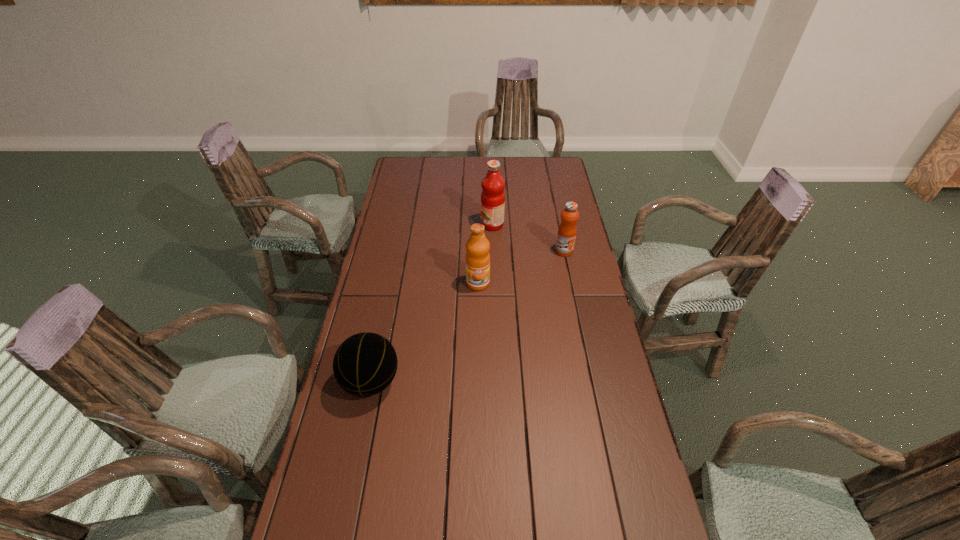
Image resolution: width=960 pixels, height=540 pixels. Find the location of `free space located 0.150m on the front label of the shortest fruit juice`. free space located 0.150m on the front label of the shortest fruit juice is located at coordinates (571, 284).

Image resolution: width=960 pixels, height=540 pixels. What are the coordinates of `vacant position located on the right of the leftmost object` in the screenshot? It's located at (509, 382).

You are a GUI agent. You are given a task and a screenshot of the screen. Output one action in this format:
    pyautogui.click(x=<x>, y=<y>)
    Task: Click on the object located at the left edge
    The width and height of the screenshot is (960, 540).
    Given the screenshot: What is the action you would take?
    pyautogui.click(x=365, y=364)

Identify the location of object that is at the right edge. (567, 230).

The width and height of the screenshot is (960, 540). In the image, there is a desktop. Find the location of `free region at the far edge`. free region at the far edge is located at coordinates (519, 175).

Locate an element on the screen. vacant space at the left edge of the desktop is located at coordinates (390, 192).

Locate an element on the screen. This screenshot has width=960, height=540. vacant space at the right edge is located at coordinates (578, 332).

Find the location of a particular element. free location at the far right corner of the desktop is located at coordinates (540, 173).

Locate an element on the screen. free space between the farthest fruit juice and the leftmost object is located at coordinates (432, 303).

Find the location of a particular element. The width and height of the screenshot is (960, 540). free space between the second nearest fruit juice and the farthest object is located at coordinates (528, 238).